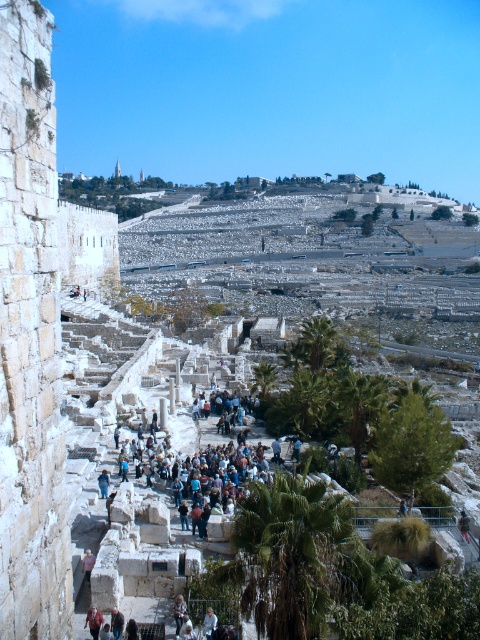
Does green leafy palm tree at center have a greater height compared to light beige fabric at center?

Correct, green leafy palm tree at center is much taller as light beige fabric at center.

This screenshot has width=480, height=640. What do you see at coordinates (314, 342) in the screenshot?
I see `green leafy palm tree at center` at bounding box center [314, 342].

Does point (328, 321) lie behind point (207, 634)?

Yes, it is behind point (207, 634).

Find the location of a particular element. Image resolution: width=480 pixels, height=640 pixels. green leafy palm tree at center is located at coordinates (314, 342).

Is green leafy palm tree at center thinner than light brown leather jacket at center?

No.

Is point (317, 337) farther from viewer compared to point (178, 596)?

That is True.

This screenshot has width=480, height=640. What do you see at coordinates (314, 342) in the screenshot?
I see `green leafy palm tree at center` at bounding box center [314, 342].

Locate an element on the screen. Image resolution: width=480 pixels, height=640 pixels. green leafy palm tree at center is located at coordinates (314, 342).

Who is taller, green leafy palm tree at lower center or light beige fabric at center?

green leafy palm tree at lower center is taller.

Between green leafy palm tree at lower center and light beige fabric at center, which one appears on the right side from the viewer's perspective?

From the viewer's perspective, green leafy palm tree at lower center appears more on the right side.

Does point (264, 620) lie behind point (215, 621)?

No.

Find the location of `green leafy palm tree at lower center`. green leafy palm tree at lower center is located at coordinates (290, 556).